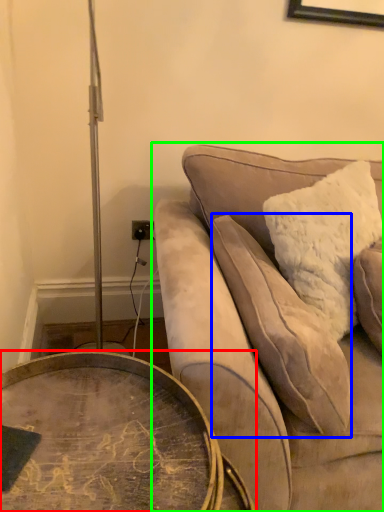
Question: Based on their relative distances, which object is nearer to coffee table (highlighted by a red box)? Choose from pillow (highlighted by a blue box) and studio couch (highlighted by a green box).

Choices:
 (A) pillow
 (B) studio couch

Answer: (B)